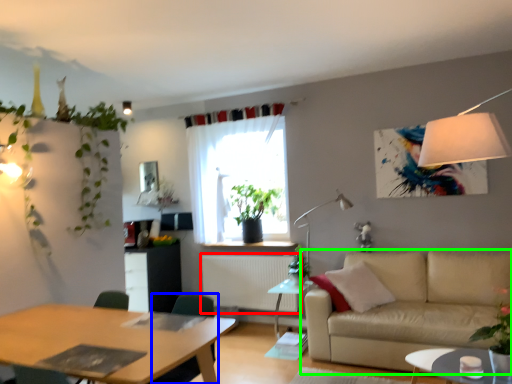
Question: Which object is positioned closest to radiator (highlighted by a red box)? Select from swivel chair (highlighted by a blue box) and studio couch (highlighted by a green box).

Choices:
 (A) swivel chair
 (B) studio couch

Answer: (B)